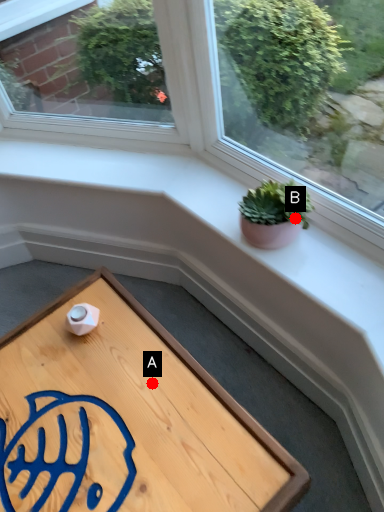
Question: Two points are circled on the image, labeled by A and B beside each circle. Which point is farther to the camera?

Choices:
 (A) A is further
 (B) B is further

Answer: (A)